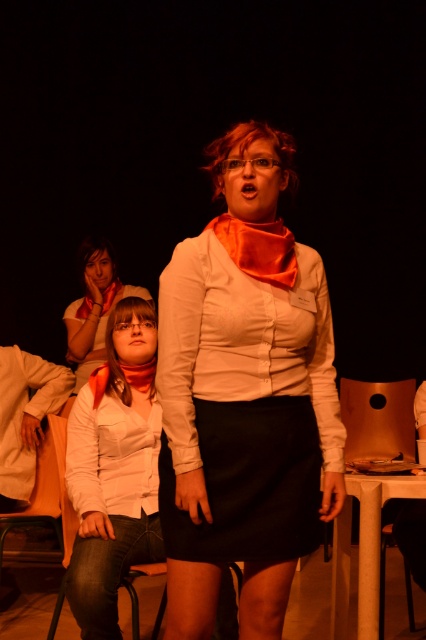
Question: Can you confirm if metallic gold chair at lower right is bigger than white cotton shirt at lower left?

Choices:
 (A) no
 (B) yes

Answer: (A)

Question: Which object is closer to the camera taking this photo?

Choices:
 (A) metallic gold chair at lower right
 (B) white denim jeans at lower left
 (C) orange matte scarf at upper center

Answer: (B)

Question: Is metallic brown chair at lower left positioned in front of orange matte scarf at upper center?

Choices:
 (A) yes
 (B) no

Answer: (A)

Question: Which point appears farthest from the camera in this image?

Choices:
 (A) tap(276, 376)
 (B) tap(100, 278)
 (C) tap(103, 301)

Answer: (B)

Question: Considering the relative positions of orange fabric scarf at lower center and orange matte scarf at upper center in the image provided, where is orange fabric scarf at lower center located with respect to orange matte scarf at upper center?

Choices:
 (A) below
 (B) above

Answer: (A)

Question: Which of the following is the closest to the observer?

Choices:
 (A) matte white scarf at upper left
 (B) matte white blouse at center
 (C) white denim jeans at lower left

Answer: (B)